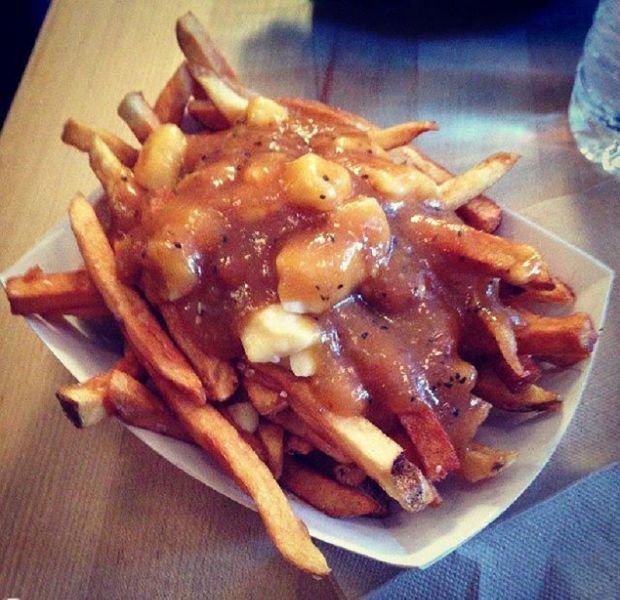
Locate an element on the screen. The image size is (620, 600). water bottle - bottom left side is located at coordinates (590, 95).